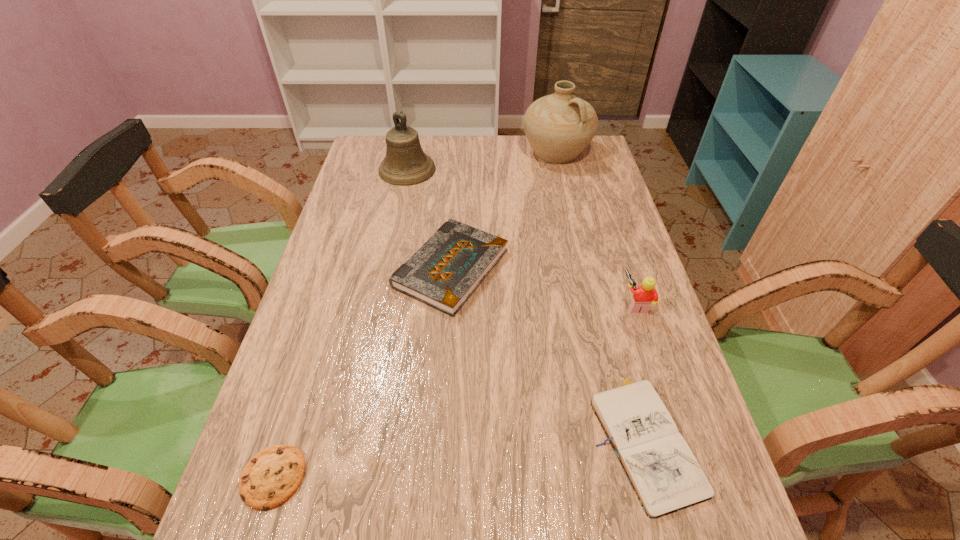
You are a GUI agent. You are given a task and a screenshot of the screen. Output one action in this format:
    pyautogui.click(x=<x>, y=<y>)
    Task: Click on the vacant area that satisfies the following two spatial constraints: 1. on the front side of the fourth tallest object; 2. on the left side of the second tallest object
    The width and height of the screenshot is (960, 540).
    Given the screenshot: What is the action you would take?
    pyautogui.click(x=387, y=268)

At what (x,y) coordinates should I click in order to perform the action: click on free point that satisfies the following two spatial constraints: 1. on the back side of the pottery; 2. on the right side of the cookie. Please return your answer as a coordinate pair (x, y). This screenshot has height=540, width=960. Looking at the image, I should click on (375, 152).